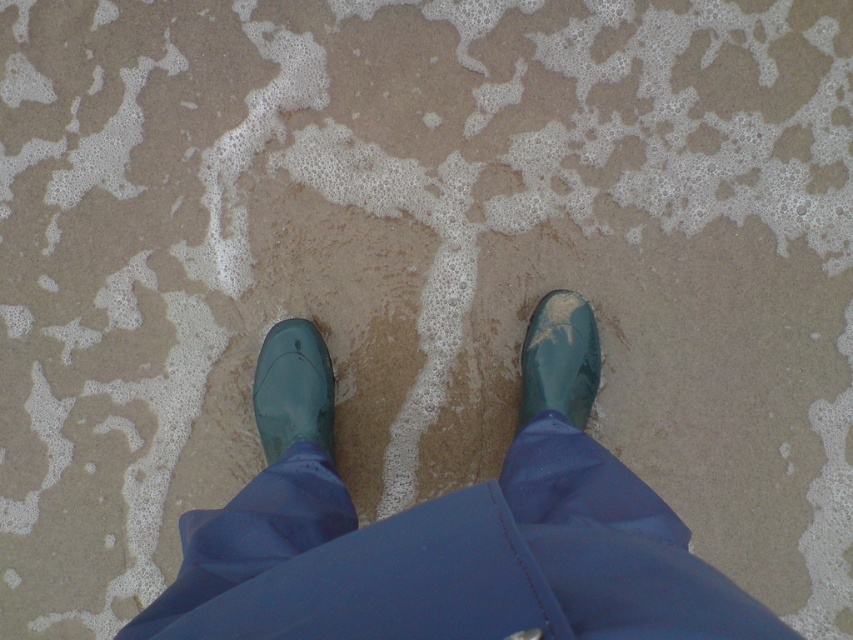
Between green rubber boots at center and glossy rubber boot at lower left, which one is positioned lower?

green rubber boots at center is lower down.

Who is positioned more to the left, green rubber boots at center or glossy rubber boot at lower left?

glossy rubber boot at lower left is more to the left.

The width and height of the screenshot is (853, 640). In order to click on green rubber boots at center in this screenshot , I will do pos(447,528).

Locate an element on the screen. The width and height of the screenshot is (853, 640). green rubber boots at center is located at coordinates (447, 528).

Can you confirm if glossy rubber boot at lower left is smaller than glossy rubber boot at lower right?

Indeed, glossy rubber boot at lower left has a smaller size compared to glossy rubber boot at lower right.

Find the location of a particular element. Image resolution: width=853 pixels, height=640 pixels. glossy rubber boot at lower left is located at coordinates (293, 388).

Does point (276, 419) come closer to viewer compared to point (561, 294)?

Yes, point (276, 419) is in front of point (561, 294).

This screenshot has width=853, height=640. Identify the location of glossy rubber boot at lower left. pyautogui.click(x=293, y=388).

Can you confirm if green rubber boots at center is positioned to the right of glossy rubber boot at lower right?

No, green rubber boots at center is not to the right of glossy rubber boot at lower right.

Can you confirm if green rubber boots at center is wider than glossy rubber boot at lower right?

Indeed, green rubber boots at center has a greater width compared to glossy rubber boot at lower right.

You are a GUI agent. You are given a task and a screenshot of the screen. Output one action in this format:
    pyautogui.click(x=<x>, y=<y>)
    Task: Click on the green rubber boots at center
    This screenshot has width=853, height=640.
    Given the screenshot: What is the action you would take?
    pyautogui.click(x=447, y=528)

Locate an element on the screen. This screenshot has height=640, width=853. green rubber boots at center is located at coordinates (447, 528).